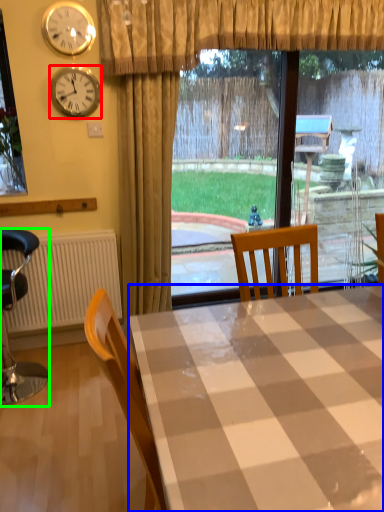
Question: Which object is the farthest from clock (highlighted by a red box)? Choose among these: desk (highlighted by a blue box) or chair (highlighted by a green box).

Choices:
 (A) desk
 (B) chair

Answer: (A)